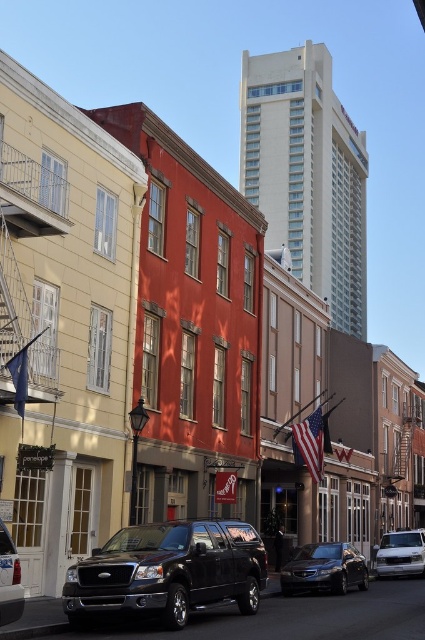
Question: Does glossy black truck at center have a smaller size compared to shiny black truck at lower left?

Choices:
 (A) no
 (B) yes

Answer: (A)

Question: Which point appears closest to the camera in this image?

Choices:
 (A) (2, 529)
 (B) (10, 374)
 (C) (345, 588)

Answer: (A)

Question: Can you confirm if silver metallic van at lower right is thinner than american flag at center?

Choices:
 (A) no
 (B) yes

Answer: (A)

Question: Which of the following is the closest to the observer?

Choices:
 (A) (401, 541)
 (B) (322, 564)
 (C) (11, 573)
 (D) (249, 545)

Answer: (C)

Question: Does shiny black sedan at center appear over blue fabric flag at lower left?

Choices:
 (A) no
 (B) yes

Answer: (A)

Question: Which object is positioned farthest from the silver metallic van at lower right?

Choices:
 (A) blue fabric flag at lower left
 (B) american flag at center

Answer: (A)